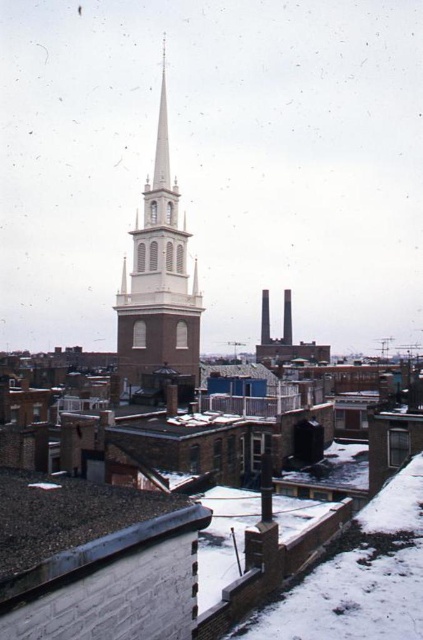
Question: Is gray shingles at lower left wider than white brick steeple at center?

Choices:
 (A) yes
 (B) no

Answer: (B)

Question: Considering the relative positions of gray shingles at lower left and white brick steeple at center in the image provided, where is gray shingles at lower left located with respect to white brick steeple at center?

Choices:
 (A) below
 (B) above

Answer: (A)

Question: Among these points, which one is farthest from the camera?

Choices:
 (A) (125, 285)
 (B) (142, 540)

Answer: (A)

Question: Is gray shingles at lower left smaller than white brick steeple at center?

Choices:
 (A) yes
 (B) no

Answer: (A)